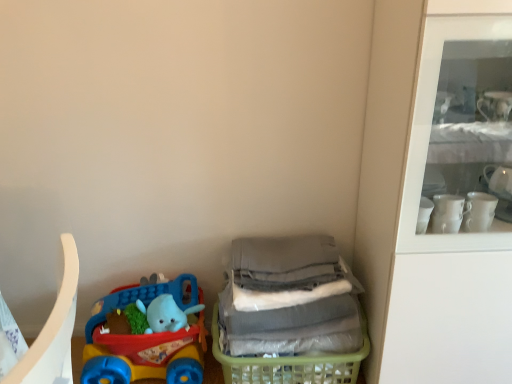
This screenshot has width=512, height=384. Describe the element at coordinates (146, 340) in the screenshot. I see `plastic toy car at lower left` at that location.

This screenshot has width=512, height=384. Find the location of `plastic toy car at lower left`. plastic toy car at lower left is located at coordinates point(146,340).

The width and height of the screenshot is (512, 384). Describe the element at coordinates (291, 364) in the screenshot. I see `translucent green plastic basket at lower right` at that location.

The image size is (512, 384). I want to click on translucent green plastic basket at lower right, so click(x=291, y=364).

In order to face translucent green plastic basket at lower right, should I rotate leftwards or rightwards?

To face it directly, rotate right by 4.432 degrees.

Where is `plastic toy car at lower left`? plastic toy car at lower left is located at coordinates (146, 340).

Which is more to the left, plastic toy car at lower left or translucent green plastic basket at lower right?

Positioned to the left is plastic toy car at lower left.

Which object is closer to the camera, plastic toy car at lower left or translucent green plastic basket at lower right?

translucent green plastic basket at lower right.

Which is behind, point (123, 290) or point (255, 364)?

The point (123, 290) is farther from the camera.

From the image's perspective, is plastic toy car at lower left under translucent green plastic basket at lower right?

Actually, plastic toy car at lower left appears above translucent green plastic basket at lower right in the image.

From a real-world perspective, which object rests below the other?

From a 3D spatial view, translucent green plastic basket at lower right is below.

Considering the sizes of objects plastic toy car at lower left and translucent green plastic basket at lower right in the image provided, who is thinner, plastic toy car at lower left or translucent green plastic basket at lower right?

plastic toy car at lower left.

Between plastic toy car at lower left and translucent green plastic basket at lower right, which one has more height?

Standing taller between the two is plastic toy car at lower left.

Is plastic toy car at lower left bigger than translucent green plastic basket at lower right?

No.

Is translucent green plastic basket at lower right completely or partially inside plastic toy car at lower left?

No, plastic toy car at lower left does not contain translucent green plastic basket at lower right.

Is plastic toy car at lower left directly adjacent to translucent green plastic basket at lower right?

There is a gap between plastic toy car at lower left and translucent green plastic basket at lower right.

Is translucent green plastic basket at lower right at the back of plastic toy car at lower left?

No, plastic toy car at lower left's orientation is not away from translucent green plastic basket at lower right.

How different are the orientations of plastic toy car at lower left and translucent green plastic basket at lower right in degrees?

The facing directions of plastic toy car at lower left and translucent green plastic basket at lower right are 0.000647 degrees apart.

Locate an element on the screen. The image size is (512, 384). basket below the plastic toy car at lower left (from a real-world perspective) is located at coordinates (291, 364).

Is translucent green plastic basket at lower right to the right of plastic toy car at lower left from the viewer's perspective?

Correct, you'll find translucent green plastic basket at lower right to the right of plastic toy car at lower left.

Looking at this image, which object is more forward, translucent green plastic basket at lower right or plastic toy car at lower left?

translucent green plastic basket at lower right is closer to the camera.

Is point (261, 382) positioned in front of point (154, 292)?

Yes, it is in front of point (154, 292).

From the image's perspective, which is above, translucent green plastic basket at lower right or plastic toy car at lower left?

plastic toy car at lower left is shown above in the image.

From a real-world perspective, between translucent green plastic basket at lower right and plastic toy car at lower left, who is vertically lower?

From a 3D spatial view, translucent green plastic basket at lower right is below.

Looking at their sizes, would you say translucent green plastic basket at lower right is wider or thinner than plastic toy car at lower left?

Considering their sizes, translucent green plastic basket at lower right looks broader than plastic toy car at lower left.

Does translucent green plastic basket at lower right have a greater height compared to plastic toy car at lower left?

Incorrect, the height of translucent green plastic basket at lower right is not larger of that of plastic toy car at lower left.

Consider the image. Considering the relative sizes of translucent green plastic basket at lower right and plastic toy car at lower left in the image provided, is translucent green plastic basket at lower right smaller than plastic toy car at lower left?

No, translucent green plastic basket at lower right is not smaller than plastic toy car at lower left.

Would you say plastic toy car at lower left is part of translucent green plastic basket at lower right's contents?

That's incorrect, plastic toy car at lower left is not inside translucent green plastic basket at lower right.

Is there a large distance between translucent green plastic basket at lower right and plastic toy car at lower left?

No.

Is translucent green plastic basket at lower right turned away from plastic toy car at lower left?

translucent green plastic basket at lower right is not turned away from plastic toy car at lower left.

From the picture: What's the angular difference between translucent green plastic basket at lower right and plastic toy car at lower left's facing directions?

The angular difference between translucent green plastic basket at lower right and plastic toy car at lower left is 0.000647 degrees.

How far apart are translucent green plastic basket at lower right and plastic toy car at lower left?

translucent green plastic basket at lower right is 11.81 inches from plastic toy car at lower left.

Where is `basket below the plastic toy car at lower left (from the image's perspective)`? This screenshot has width=512, height=384. basket below the plastic toy car at lower left (from the image's perspective) is located at coordinates (291, 364).

Image resolution: width=512 pixels, height=384 pixels. In the image, there is a plastic toy car at lower left. In order to click on basket below it (from the image's perspective) in this screenshot , I will do `click(291, 364)`.

Image resolution: width=512 pixels, height=384 pixels. In order to click on toy located on the left of translucent green plastic basket at lower right in this screenshot , I will do `click(146, 340)`.